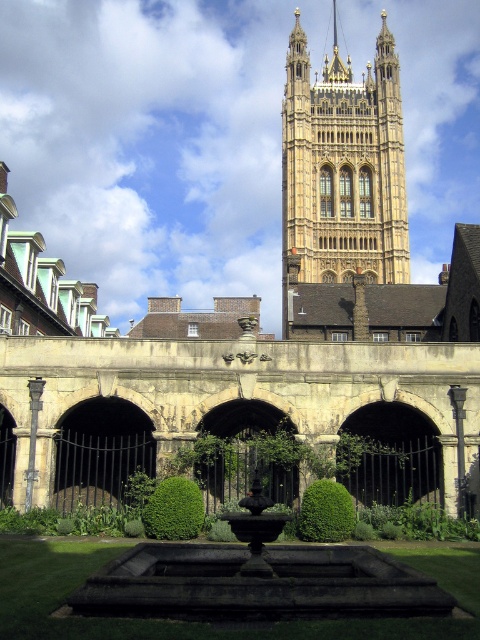
Does golden stone tower at upper center have a smaller size compared to dark stone fountain at center?

Actually, golden stone tower at upper center might be larger than dark stone fountain at center.

Which is in front, point (337, 109) or point (380, 604)?

Point (380, 604) is more forward.

Between point (320, 83) and point (271, 604), which one is positioned in front?

Point (271, 604) is in front.

Locate an element on the screen. golden stone tower at upper center is located at coordinates (342, 170).